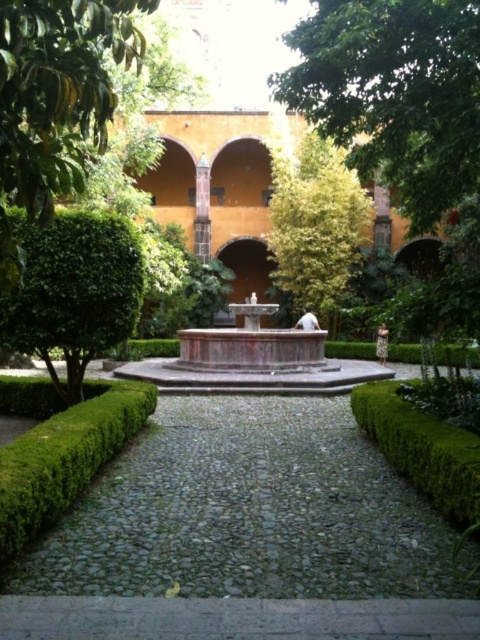
You are a gardener planning to plant a new row of flowers between the green leafy bush at left and the green leafy hedge at lower right. Considering their widths, which one has more space available next to it for planting?

The green leafy bush at left has more space available next to it for planting since its width surpasses that of the green leafy hedge at lower right.

You are a gardener planning to place a decorative statue on the gray cobblestone path at center. Considering the green leafy bush at left, will the statue be easily visible from the front entrance of the building?

The gray cobblestone path at center has a lesser height compared to green leafy bush at left, so the statue placed on the gray cobblestone path at center may be partially obscured by the taller green leafy bush at left, making it less visible from the front entrance.

You are a tour guide leading a group from the entrance to the fountain. You need to walk from the green leafy bush at left to the gray cobblestone path at center. How far will you have to walk?

The distance between the green leafy bush at left and the gray cobblestone path at center is 9.07 meters, so you will have to walk 9.07 meters to reach the gray cobblestone path at center from the green leafy bush at left.